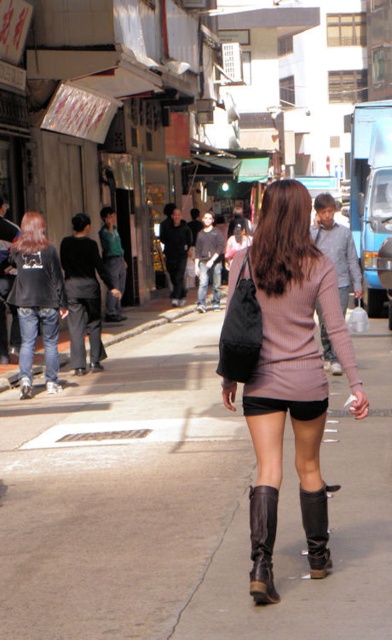
Can you confirm if brown concrete pavement at center is bigger than pale pink sweater at center?

Yes.

Can you confirm if brown concrete pavement at center is taller than pale pink sweater at center?

Yes.

Find the location of a particular element. brown concrete pavement at center is located at coordinates (183, 502).

Where is `brown concrete pavement at center`? brown concrete pavement at center is located at coordinates (183, 502).

How distant is matte pink sweater at center from leather boots at lower center?

matte pink sweater at center is 8.84 inches from leather boots at lower center.

Is point (263, 365) positioned before point (315, 552)?

Yes, it is.

This screenshot has width=392, height=640. I want to click on matte pink sweater at center, so click(x=283, y=369).

Which is above, brown concrete pavement at center or brown leather boot at lower center?

brown concrete pavement at center

Is brown concrete pavement at center shorter than brown leather boot at lower center?

Incorrect, brown concrete pavement at center's height does not fall short of brown leather boot at lower center's.

The width and height of the screenshot is (392, 640). What do you see at coordinates (183, 502) in the screenshot?
I see `brown concrete pavement at center` at bounding box center [183, 502].

Where is `brown concrete pavement at center`? The height and width of the screenshot is (640, 392). brown concrete pavement at center is located at coordinates (183, 502).